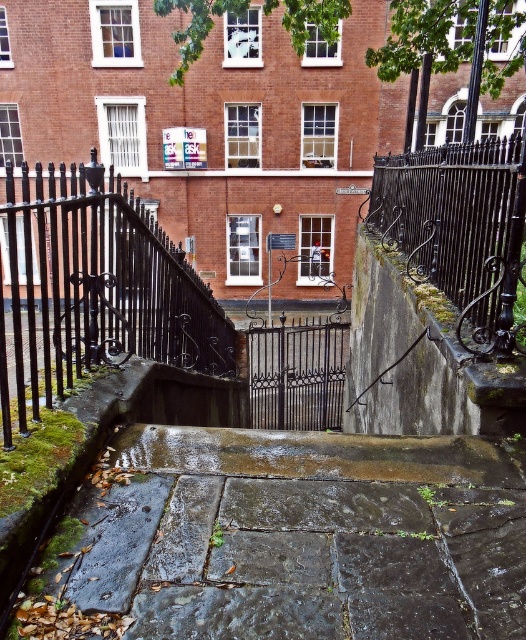
You are a delivery person carrying a heavy package and need to walk up the stone steps. You notice the wet stone pavement at center and the black wrought iron fence at center. Which object is more likely to be slippery due to its surface characteristics?

The wet stone pavement at center is more likely to be slippery because it has a smooth surface, while the black wrought iron fence at center has a textured surface with intricate designs that provide better traction.